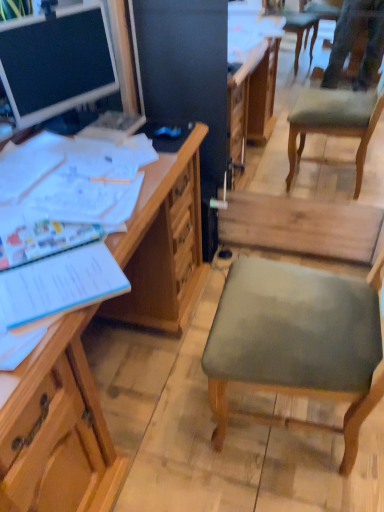
Question: Does wooden desk at left, which appears as the first desk when ordered from the bottom, have a lesser width compared to blue paper notebook at left?

Choices:
 (A) no
 (B) yes

Answer: (A)

Question: Can you confirm if wooden desk at left, which appears as the first desk when ordered from the bottom, is smaller than blue paper notebook at left?

Choices:
 (A) yes
 (B) no

Answer: (B)

Question: Is wooden desk at left, which appears as the first desk when ordered from the bottom, beside blue paper notebook at left?

Choices:
 (A) no
 (B) yes

Answer: (A)

Question: Could you tell me if wooden desk at left, which appears as the first desk when ordered from the bottom, is turned towards blue paper notebook at left?

Choices:
 (A) no
 (B) yes

Answer: (A)

Question: From the image's perspective, does wooden desk at left, which appears as the first desk when ordered from the bottom, appear lower than blue paper notebook at left?

Choices:
 (A) no
 (B) yes

Answer: (B)

Question: Is matte wooden desk at upper left, which is counted as the second desk, starting from the bottom, inside or outside of wooden desk at left, the 2th desk from the top?

Choices:
 (A) inside
 (B) outside

Answer: (B)

Question: In the image, is matte wooden desk at upper left, the 1th desk in the top-to-bottom sequence, on the left side or the right side of wooden desk at left, the 2th desk from the top?

Choices:
 (A) left
 (B) right

Answer: (A)

Question: Is point click(x=41, y=106) closer or farther from the camera than point click(x=167, y=225)?

Choices:
 (A) closer
 (B) farther

Answer: (B)

Question: Based on their sizes in the image, would you say matte wooden desk at upper left, which is counted as the second desk, starting from the bottom, is bigger or smaller than wooden desk at left, the 2th desk from the top?

Choices:
 (A) big
 (B) small

Answer: (B)

Question: Considering the relative positions of blue paper notebook at left and matte wooden desk at upper left, the 1th desk in the top-to-bottom sequence, in the image provided, is blue paper notebook at left to the left or to the right of matte wooden desk at upper left, the 1th desk in the top-to-bottom sequence,?

Choices:
 (A) left
 (B) right

Answer: (B)

Question: From the image's perspective, relative to matte wooden desk at upper left, which is counted as the second desk, starting from the bottom, is blue paper notebook at left above or below?

Choices:
 (A) below
 (B) above

Answer: (A)

Question: In the image, is blue paper notebook at left positioned in front of or behind matte wooden desk at upper left, which is counted as the second desk, starting from the bottom?

Choices:
 (A) behind
 (B) front

Answer: (B)

Question: From a real-world perspective, is blue paper notebook at left above or below matte wooden desk at upper left, which is counted as the second desk, starting from the bottom?

Choices:
 (A) above
 (B) below

Answer: (B)

Question: In terms of width, does wooden desk at left, the 2th desk from the top, look wider or thinner when compared to matte wooden desk at upper left, the 1th desk in the top-to-bottom sequence?

Choices:
 (A) thin
 (B) wide

Answer: (B)

Question: Is wooden desk at left, the 2th desk from the top, to the left or to the right of matte wooden desk at upper left, the 1th desk in the top-to-bottom sequence, in the image?

Choices:
 (A) right
 (B) left

Answer: (A)